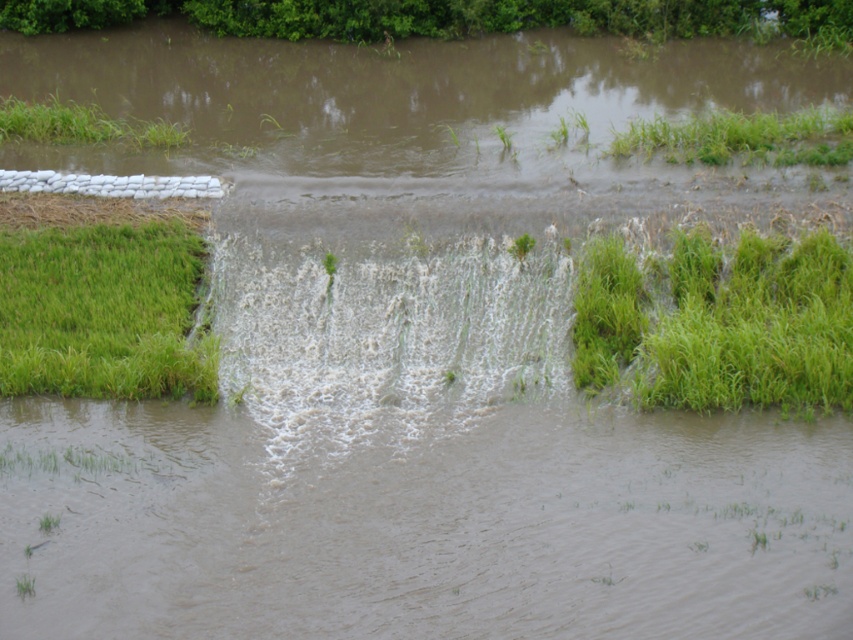
Who is more forward, (103, 234) or (502, 128)?

Point (103, 234)

Find the location of a particular element. green soft grass at lower left is located at coordinates (102, 312).

Can you confirm if green soft grass at lower left is shorter than green grass at upper left?

Incorrect, green soft grass at lower left's height does not fall short of green grass at upper left's.

Is green soft grass at lower left above green grass at upper left?

No, green soft grass at lower left is not above green grass at upper left.

Which is in front, point (119, 316) or point (9, 124)?

Point (119, 316) is in front.

You are a GUI agent. You are given a task and a screenshot of the screen. Output one action in this format:
    pyautogui.click(x=<x>, y=<y>)
    Task: Click on the green soft grass at lower left
    The height and width of the screenshot is (640, 853).
    Given the screenshot: What is the action you would take?
    pyautogui.click(x=102, y=312)

Can you confirm if green leafy grass at lower right is positioned to the right of green grass at upper left?

Correct, you'll find green leafy grass at lower right to the right of green grass at upper left.

Image resolution: width=853 pixels, height=640 pixels. Describe the element at coordinates (721, 323) in the screenshot. I see `green leafy grass at lower right` at that location.

You are a GUI agent. You are given a task and a screenshot of the screen. Output one action in this format:
    pyautogui.click(x=<x>, y=<y>)
    Task: Click on the green leafy grass at lower right
    Image resolution: width=853 pixels, height=640 pixels.
    Given the screenshot: What is the action you would take?
    pyautogui.click(x=721, y=323)